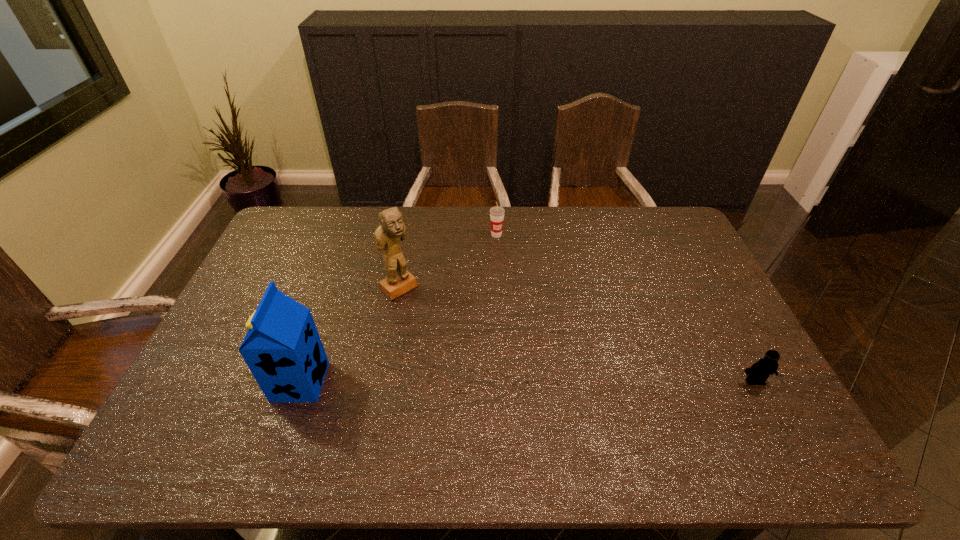
Find the location of a particular element. The height and width of the screenshot is (540, 960). free space located on the front-facing side of the figurine is located at coordinates (424, 310).

I want to click on free space located 0.140m on the front-facing side of the figurine, so click(439, 323).

Locate an element on the screen. Image resolution: width=960 pixels, height=540 pixels. vacant space situated 0.280m on the front-facing side of the figurine is located at coordinates (471, 351).

This screenshot has width=960, height=540. In order to click on free space located on the side of the third tallest object with the logo in this screenshot , I will do `click(540, 312)`.

Identify the location of vacant space positioned 0.270m on the side of the third tallest object with the logo. The image size is (960, 540). 527,289.

This screenshot has height=540, width=960. In order to click on vacant space located 0.300m on the side of the third tallest object with the logo in this screenshot , I will do `click(531, 296)`.

Where is `object that is at the far edge`? object that is at the far edge is located at coordinates (496, 213).

Where is `object present at the near edge`? This screenshot has width=960, height=540. object present at the near edge is located at coordinates pos(282,348).

In order to click on object at the right edge in this screenshot , I will do `click(759, 372)`.

What are the coordinates of `free space at the far edge of the desktop` in the screenshot? It's located at pyautogui.click(x=533, y=232).